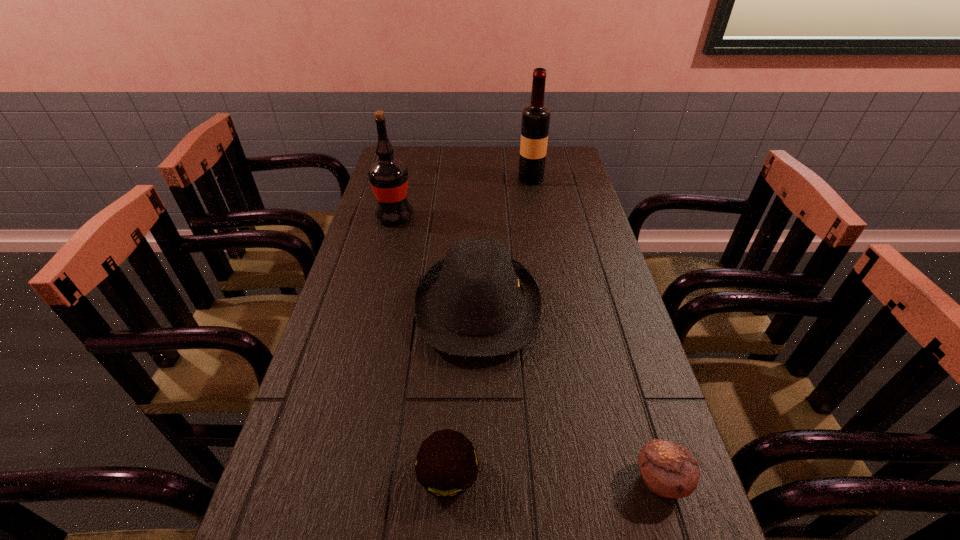
The height and width of the screenshot is (540, 960). In order to click on blank space located 0.160m on the front-facing side of the third farthest object in this screenshot , I will do `click(604, 307)`.

Identify the location of blank space located on the left of the patty. pos(274,475).

Find the location of a particular element. The height and width of the screenshot is (540, 960). vacant space located on the left of the rightmost object is located at coordinates (562, 480).

Locate an element on the screen. The height and width of the screenshot is (540, 960). object that is at the far edge is located at coordinates (535, 117).

This screenshot has width=960, height=540. Identify the location of object that is at the left edge. (388, 176).

Where is `wine bottle present at the right edge`? This screenshot has height=540, width=960. wine bottle present at the right edge is located at coordinates (535, 117).

Locate an element on the screen. This screenshot has width=960, height=540. muffin located in the right edge section of the desktop is located at coordinates (668, 469).

You are a GUI agent. You are given a task and a screenshot of the screen. Output one action in this format:
    pyautogui.click(x=<x>, y=<y>)
    Task: Click on the object that is positioned at the far right corner
    The width and height of the screenshot is (960, 540).
    Given the screenshot: What is the action you would take?
    pyautogui.click(x=535, y=117)

The height and width of the screenshot is (540, 960). Identify the location of vacant area at the far edge. (510, 158).

Where is `vacant space at the left edge of the desktop`? vacant space at the left edge of the desktop is located at coordinates (299, 417).